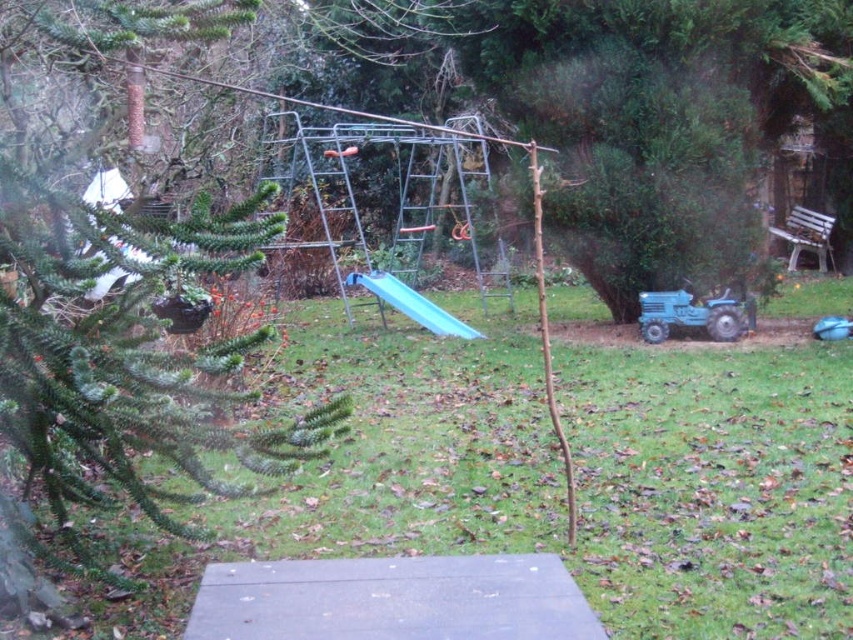
Question: Considering the real-world distances, which object is closest to the green grass at center?

Choices:
 (A) blue matte tractor at lower right
 (B) blue plastic slide at center

Answer: (B)

Question: Can you confirm if green grass at center is positioned above blue matte tractor at lower right?

Choices:
 (A) yes
 (B) no

Answer: (B)

Question: Is blue matte tractor at lower right to the left of blue plastic slide at center from the viewer's perspective?

Choices:
 (A) no
 (B) yes

Answer: (A)

Question: Which point appears farthest from the camera in this image?

Choices:
 (A) (x=677, y=301)
 (B) (x=367, y=273)
 (C) (x=846, y=499)

Answer: (B)

Question: Which point is farther from the camera taking this photo?

Choices:
 (A) (437, 332)
 (B) (426, 522)
 (C) (660, 292)

Answer: (A)

Question: Can you confirm if green grass at center is wider than blue matte tractor at lower right?

Choices:
 (A) yes
 (B) no

Answer: (B)